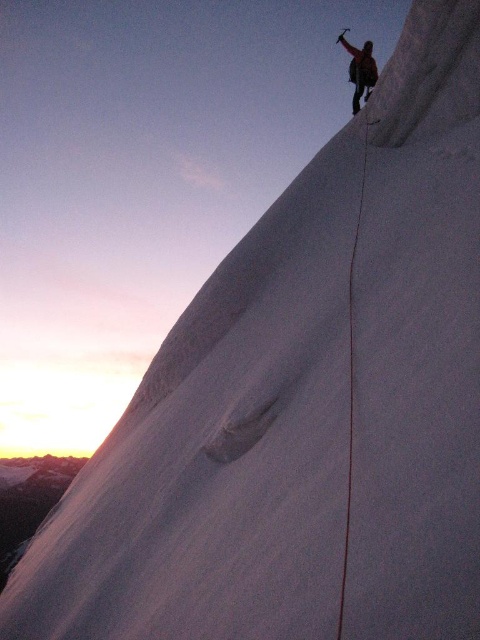
Which is above, smooth ice crack at upper right or dark brown leather jacket at upper right?

dark brown leather jacket at upper right

Can you confirm if smooth ice crack at upper right is bigger than dark brown leather jacket at upper right?

Yes.

At what (x,y) coordinates should I click in order to perform the action: click on smooth ice crack at upper right. Please return your answer as a coordinate pair (x, y). Looking at the image, I should click on (351, 378).

Locate an element on the screen. Image resolution: width=480 pixels, height=640 pixels. smooth ice crack at upper right is located at coordinates (351, 378).